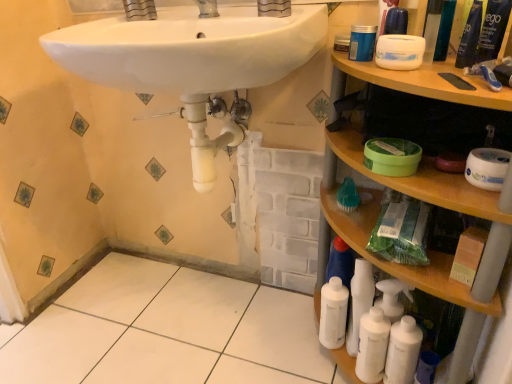
Find the location of a particular element. Image resolution: width=512 pixels, height=384 pixels. vacant space in front of matte silver faucet at upper center is located at coordinates (257, 26).